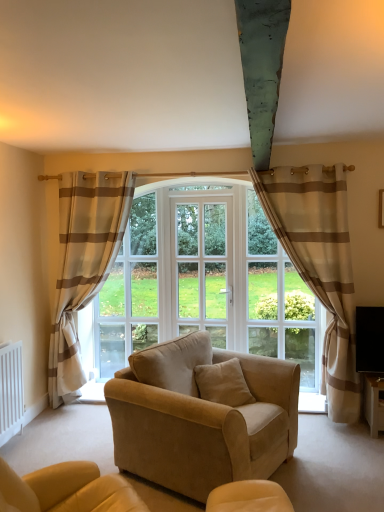
Identify the location of suede beige couch at center. Image resolution: width=384 pixels, height=512 pixels. (202, 415).

The image size is (384, 512). Identify the location of white plastic radiator at lower left. (11, 391).

What do you see at coordinates (202, 267) in the screenshot? I see `white glass screen door at center` at bounding box center [202, 267].

What do you see at coordinates (83, 264) in the screenshot? I see `beige striped curtain at left, the 1th curtain when ordered from left to right` at bounding box center [83, 264].

Where is `suede beige couch at center`? This screenshot has width=384, height=512. suede beige couch at center is located at coordinates (202, 415).

From the image's perspective, which is above, beige striped curtain at left, the 1th curtain when ordered from left to right, or white glass screen door at center?

white glass screen door at center.

Is beige striped curtain at left, the 1th curtain when ordered from left to right, positioned far away from white glass screen door at center?

No, beige striped curtain at left, the 1th curtain when ordered from left to right, is not far away from white glass screen door at center.

Visually, is beige striped curtain at left, acting as the second curtain starting from the right, positioned to the left or to the right of white glass screen door at center?

beige striped curtain at left, acting as the second curtain starting from the right, is to the left of white glass screen door at center.

Measure the distance from beige striped curtain at left, the 1th curtain when ordered from left to right, to white glass screen door at center.

beige striped curtain at left, the 1th curtain when ordered from left to right, is 36.79 inches away from white glass screen door at center.

Considering the sizes of objects white glass screen door at center and clear glass window at center in the image provided, who is bigger, white glass screen door at center or clear glass window at center?

clear glass window at center is bigger.

Would you say white glass screen door at center is inside or outside clear glass window at center?

white glass screen door at center is located beyond the bounds of clear glass window at center.

Which is closer, (186, 281) or (125, 281)?

Clearly, point (186, 281) is closer to the camera than point (125, 281).

Consider the image. From the image's perspective, which is above, white glass screen door at center or clear glass window at center?

white glass screen door at center appears higher in the image.

Choose the correct answer: Is suede beige couch at center inside clear glass window at center or outside it?

suede beige couch at center is located beyond the bounds of clear glass window at center.

Does suede beige couch at center lie in front of clear glass window at center?

Yes, suede beige couch at center is closer to the camera.

Is suede beige couch at center looking in the opposite direction of clear glass window at center?

Yes.

Between suede beige couch at center and clear glass window at center, which one has smaller size?

clear glass window at center.

Does beige striped curtain at right, the 1th curtain from the right, have a larger size compared to white plastic radiator at lower left?

Yes, beige striped curtain at right, the 1th curtain from the right, is bigger than white plastic radiator at lower left.

Between point (342, 259) and point (2, 362), which one is positioned in front?

The point (2, 362) is in front.

From a real-world perspective, who is located higher, beige striped curtain at right, the 1th curtain from the right, or white plastic radiator at lower left?

In real-world perspective, beige striped curtain at right, the 1th curtain from the right, is above.

Consider the image. Does beige striped curtain at right, the 1th curtain from the right, touch white plastic radiator at lower left?

No, beige striped curtain at right, the 1th curtain from the right, is not touching white plastic radiator at lower left.

Could you tell me if beige striped curtain at left, acting as the second curtain starting from the right, is facing suede beige couch at center?

No, beige striped curtain at left, acting as the second curtain starting from the right, is not oriented towards suede beige couch at center.

Considering the sizes of objects beige striped curtain at left, acting as the second curtain starting from the right, and suede beige couch at center in the image provided, who is bigger, beige striped curtain at left, acting as the second curtain starting from the right, or suede beige couch at center?

suede beige couch at center is bigger.

Considering the positions of objects beige striped curtain at left, acting as the second curtain starting from the right, and suede beige couch at center in the image provided, who is more to the left, beige striped curtain at left, acting as the second curtain starting from the right, or suede beige couch at center?

From the viewer's perspective, beige striped curtain at left, acting as the second curtain starting from the right, appears more on the left side.

Is beige striped curtain at left, the 1th curtain when ordered from left to right, closer to the viewer compared to suede beige couch at center?

No, beige striped curtain at left, the 1th curtain when ordered from left to right, is behind suede beige couch at center.

From the image's perspective, relative to beige striped curtain at left, acting as the second curtain starting from the right, is beige striped curtain at right, the second curtain from the left, above or below?

beige striped curtain at right, the second curtain from the left, is above beige striped curtain at left, acting as the second curtain starting from the right.

Between beige striped curtain at right, the 1th curtain from the right, and beige striped curtain at left, acting as the second curtain starting from the right, which one has more height?

With more height is beige striped curtain at left, acting as the second curtain starting from the right.

Is beige striped curtain at right, the second curtain from the left, located outside beige striped curtain at left, acting as the second curtain starting from the right?

Indeed, beige striped curtain at right, the second curtain from the left, is completely outside beige striped curtain at left, acting as the second curtain starting from the right.

From a real-world perspective, between beige striped curtain at left, acting as the second curtain starting from the right, and clear glass window at center, who is vertically lower?

From a 3D spatial view, clear glass window at center is below.

Which object is closer to the camera taking this photo, beige striped curtain at left, acting as the second curtain starting from the right, or clear glass window at center?

beige striped curtain at left, acting as the second curtain starting from the right.

Is beige striped curtain at left, acting as the second curtain starting from the right, aimed at clear glass window at center?

Yes, beige striped curtain at left, acting as the second curtain starting from the right, is facing clear glass window at center.

Can you confirm if beige striped curtain at left, acting as the second curtain starting from the right, is wider than clear glass window at center?

Yes.

Where is `screen door lying behind the beige striped curtain at left, the 1th curtain when ordered from left to right`? screen door lying behind the beige striped curtain at left, the 1th curtain when ordered from left to right is located at coordinates (202, 267).

What are the coordinates of `screen door that appears above the clear glass window at center (from a real-world perspective)` in the screenshot? It's located at (202, 267).

Estimate the real-world distances between objects in this image. Which object is closer to suede beige couch at center, clear glass window at center or white plastic radiator at lower left?

white plastic radiator at lower left is closer to suede beige couch at center.

When comparing their distances from white glass screen door at center, does beige striped curtain at left, the 1th curtain when ordered from left to right, or beige striped curtain at right, the 1th curtain from the right, seem closer?

beige striped curtain at left, the 1th curtain when ordered from left to right, lies closer to white glass screen door at center than the other object.

Which object lies nearer to the anchor point beige striped curtain at right, the second curtain from the left, suede beige couch at center or beige striped curtain at left, the 1th curtain when ordered from left to right?

suede beige couch at center.

Based on their spatial positions, is suede beige couch at center or beige striped curtain at right, the 1th curtain from the right, closer to clear glass window at center?

Among the two, suede beige couch at center is located nearer to clear glass window at center.

Based on their spatial positions, is white plastic radiator at lower left or white glass screen door at center further from beige striped curtain at left, the 1th curtain when ordered from left to right?

white plastic radiator at lower left is further to beige striped curtain at left, the 1th curtain when ordered from left to right.

When comparing their distances from suede beige couch at center, does beige striped curtain at left, the 1th curtain when ordered from left to right, or white glass screen door at center seem closer?

The object closer to suede beige couch at center is white glass screen door at center.

Which object lies further to the anchor point beige striped curtain at left, the 1th curtain when ordered from left to right, white glass screen door at center or beige striped curtain at right, the 1th curtain from the right?

beige striped curtain at right, the 1th curtain from the right, is further to beige striped curtain at left, the 1th curtain when ordered from left to right.

Estimate the real-world distances between objects in this image. Which object is closer to suede beige couch at center, clear glass window at center or white glass screen door at center?

Based on the image, white glass screen door at center appears to be nearer to suede beige couch at center.

The width and height of the screenshot is (384, 512). Identify the location of radiator between suede beige couch at center and clear glass window at center along the z-axis. (11, 391).

The width and height of the screenshot is (384, 512). In order to click on window screen between white plastic radiator at lower left and beige striped curtain at right, the 1th curtain from the right, in the horizontal direction in this screenshot , I will do `click(129, 293)`.

Where is `window screen located between white plastic radiator at lower left and white glass screen door at center in the left-right direction`? window screen located between white plastic radiator at lower left and white glass screen door at center in the left-right direction is located at coordinates (x=129, y=293).

The width and height of the screenshot is (384, 512). I want to click on curtain situated between white plastic radiator at lower left and white glass screen door at center from left to right, so coord(83,264).